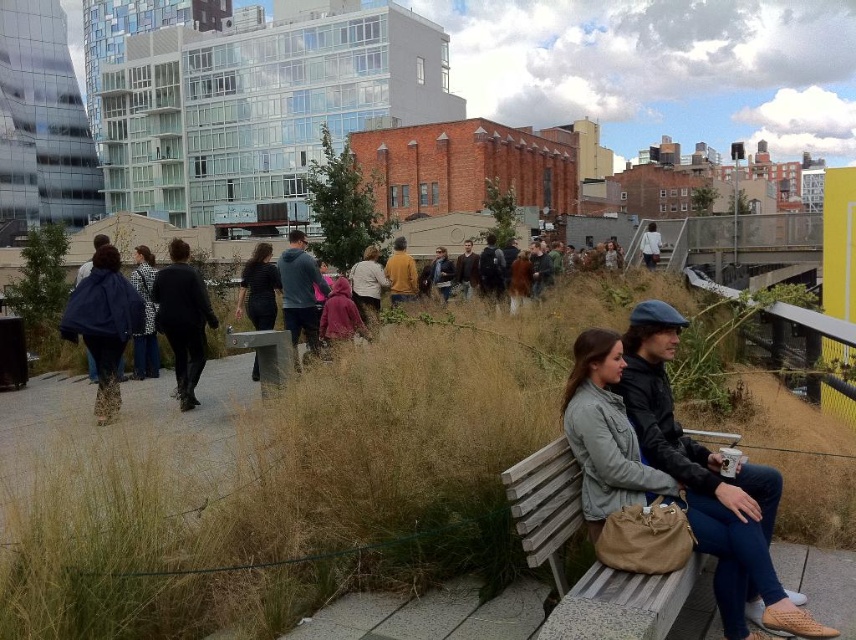
Is point (277, 268) positioned behind point (146, 289)?

Yes.

Who is taller, matte blue hoodie at center or plaid fabric coat at center?

With more height is plaid fabric coat at center.

Does point (287, 320) lie behind point (152, 262)?

No, (287, 320) is closer to viewer.

You are a GUI agent. You are given a task and a screenshot of the screen. Output one action in this format:
    pyautogui.click(x=<x>, y=<y>)
    Task: Click on the matte blue hoodie at center
    
    Given the screenshot: What is the action you would take?
    pyautogui.click(x=300, y=291)

Which is above, wooden bench at lower right or dark brown leather jacket at center?

dark brown leather jacket at center is above.

Who is more distant from viewer, [596,612] or [535,259]?

The point [535,259] is behind.

Is point (530, 460) more distant than point (538, 253)?

No, it is not.

Identify the location of wooden bench at lower right. (593, 561).

Looking at this image, is matte blue hoodie at center below brown leather jacket at center?

Indeed, matte blue hoodie at center is positioned under brown leather jacket at center.

Does point (316, 276) lie in front of point (456, 282)?

Yes.

Where is `matte blue hoodie at center`? The width and height of the screenshot is (856, 640). matte blue hoodie at center is located at coordinates (300, 291).